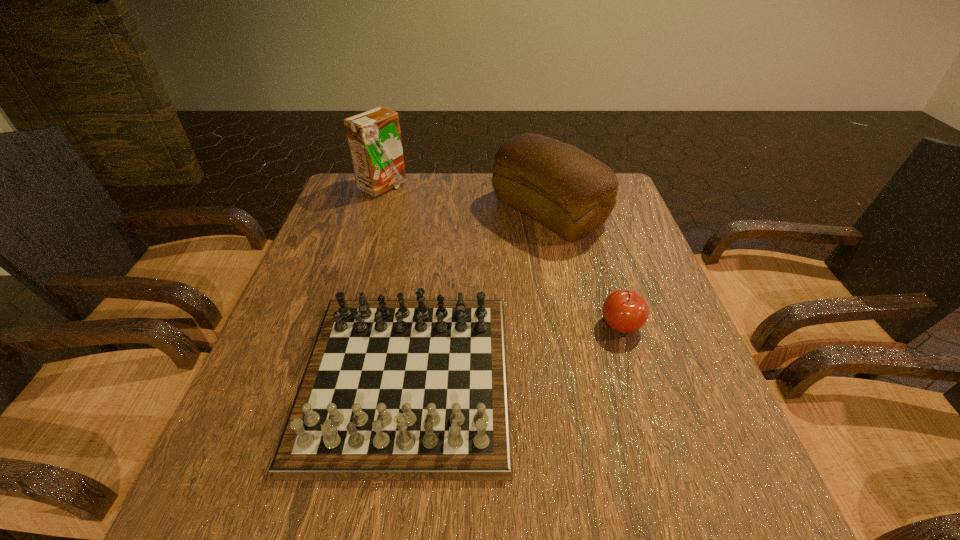
This screenshot has height=540, width=960. What are the coordinates of `empty space that is in between the carton and the bread` in the screenshot? It's located at (466, 199).

Locate an element on the screen. unoccupied area between the apple and the bread is located at coordinates (585, 268).

Identify which object is the second closest to the apple. Please provide its 2D coordinates. Your answer should be formatted as a tuple, i.e. [(x, y)], where the tuple contains the x and y coordinates of a point satisfying the conditions above.

[(570, 192)]

Locate which object ranks third in proximity to the carton. Please provide its 2D coordinates. Your answer should be formatted as a tuple, i.e. [(x, y)], where the tuple contains the x and y coordinates of a point satisfying the conditions above.

[(625, 311)]

You are a GUI agent. You are given a task and a screenshot of the screen. Output one action in this format:
    pyautogui.click(x=<x>, y=<y>)
    Task: Click on the free space that satisfies the following two spatial constraints: 1. on the back side of the bread; 2. on the straw side of the carton
    This screenshot has width=960, height=540.
    Given the screenshot: What is the action you would take?
    pyautogui.click(x=543, y=187)

Identify the location of free location that satisfies the following two spatial constraints: 1. on the straw side of the bread; 2. on the left side of the carton. (374, 212).

This screenshot has width=960, height=540. What are the coordinates of `vacant area in the image that satisfies the following two spatial constraints: 1. on the straw side of the carton; 2. on the right side of the bread` in the screenshot? It's located at (374, 212).

Image resolution: width=960 pixels, height=540 pixels. Find the location of `vacant space that satisfies the following two spatial constraints: 1. on the straw side of the carton; 2. on the left side of the bread`. vacant space that satisfies the following two spatial constraints: 1. on the straw side of the carton; 2. on the left side of the bread is located at coordinates (374, 212).

You are a GUI agent. You are given a task and a screenshot of the screen. Output one action in this format:
    pyautogui.click(x=<x>, y=<y>)
    Task: Click on the free spot that satisfies the following two spatial constraints: 1. on the back side of the bread; 2. on the straw side of the carton
    
    Given the screenshot: What is the action you would take?
    pyautogui.click(x=543, y=187)

Image resolution: width=960 pixels, height=540 pixels. I want to click on blank area in the image that satisfies the following two spatial constraints: 1. on the straw side of the carton; 2. on the back side of the bread, so click(x=374, y=212).